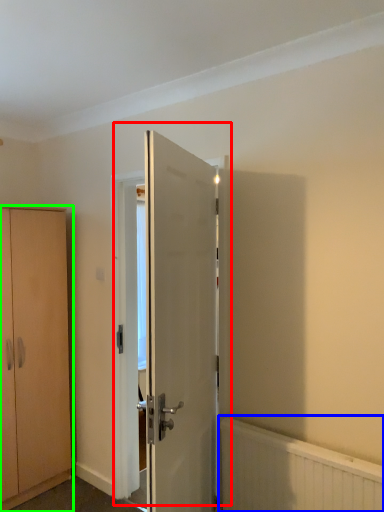
Question: Which object is positioned farthest from door (highlighted by a red box)? Select from radiator (highlighted by a blue box) and cabinetry (highlighted by a green box).

Choices:
 (A) radiator
 (B) cabinetry

Answer: (B)